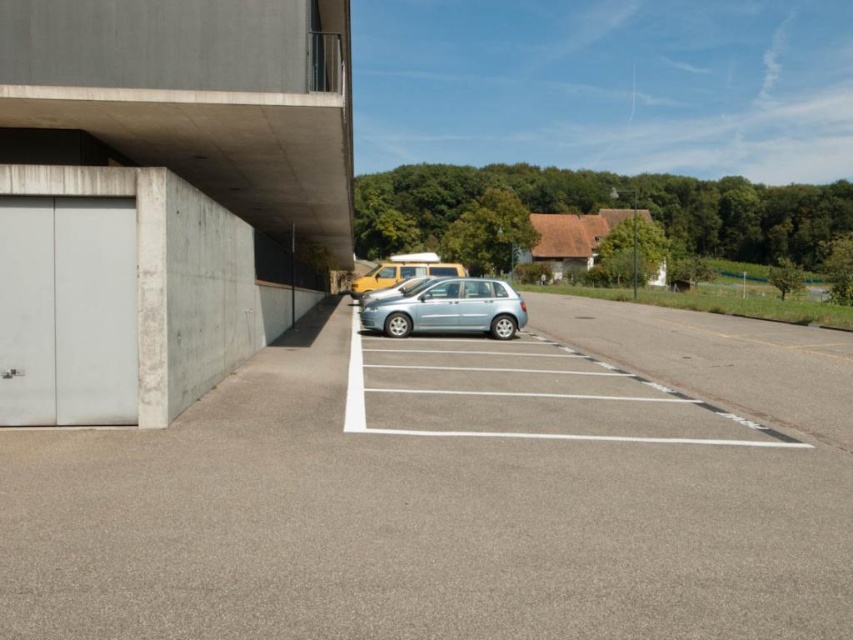
Question: Is gray asphalt parking lot at center to the left of white matte garage door at left from the viewer's perspective?

Choices:
 (A) no
 (B) yes

Answer: (A)

Question: Does concrete at left have a larger size compared to satin silver car at center?

Choices:
 (A) no
 (B) yes

Answer: (B)

Question: Which point is closer to the camera?

Choices:
 (A) (331, 134)
 (B) (117, 198)

Answer: (B)

Question: Which point is farther to the camera?

Choices:
 (A) satin blue hatchback at center
 (B) white matte garage door at left

Answer: (A)

Question: From the image, what is the correct spatial relationship of gray asphalt parking lot at center in relation to concrete at left?

Choices:
 (A) right
 (B) left

Answer: (A)

Question: Estimate the real-world distances between objects in this image. Which object is closer to the satin blue hatchback at center?

Choices:
 (A) satin silver car at center
 (B) metallic yellow van at center

Answer: (A)